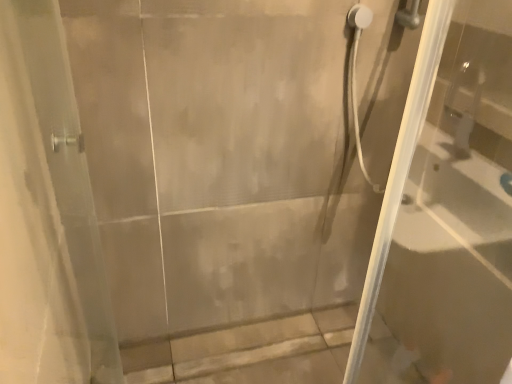
What is the approximate width of white glossy bath at right?

1.33 inches.

The height and width of the screenshot is (384, 512). What do you see at coordinates (452, 265) in the screenshot?
I see `white glossy bath at right` at bounding box center [452, 265].

Measure the distance between point (487, 191) and camera.

Point (487, 191) and camera are 1.06 meters apart.

Find the location of a particular element. The width and height of the screenshot is (512, 384). white glossy bath at right is located at coordinates (452, 265).

I want to click on white glossy bath at right, so click(452, 265).